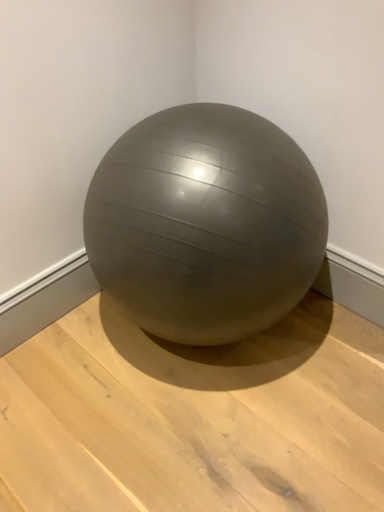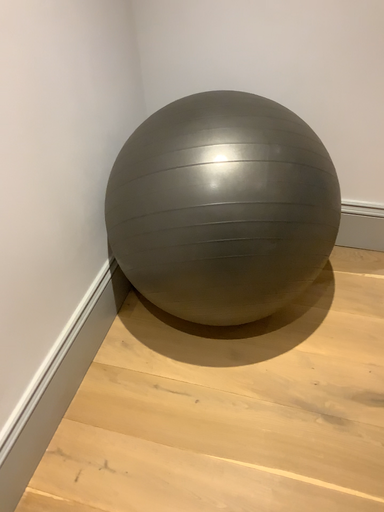
Question: How did the camera likely rotate when shooting the video?

Choices:
 (A) rotated left
 (B) rotated right

Answer: (B)